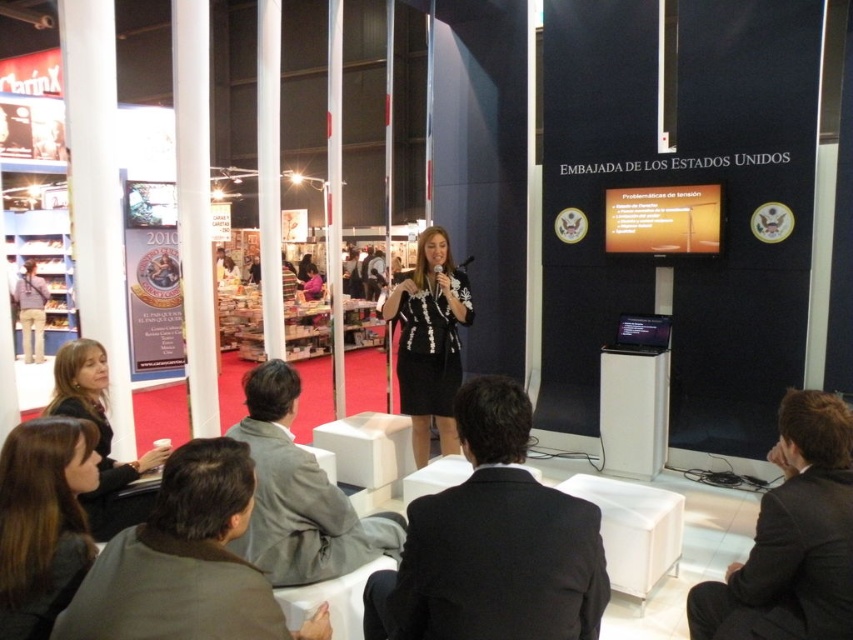
Question: Can you confirm if gray wool suit at lower center is positioned above matte black jacket at lower left?

Choices:
 (A) yes
 (B) no

Answer: (B)

Question: Among these objects, which one is farthest from the camera?

Choices:
 (A) black suit at center
 (B) black suit at lower right
 (C) gray wool suit at lower center

Answer: (C)

Question: Which object is the farthest from the black suit at lower right?

Choices:
 (A) brown fabric suit at lower left
 (B) dark brown hair at lower left
 (C) black suit at center
 (D) khaki cotton pants at lower left

Answer: (D)

Question: Is black suit at lower right wider than gray wool suit at lower center?

Choices:
 (A) no
 (B) yes

Answer: (A)

Question: In this image, where is black suit at center located relative to gray wool suit at lower center?

Choices:
 (A) left
 (B) right

Answer: (B)

Question: Which point is closer to the camera?

Choices:
 (A) dark brown hair at lower left
 (B) khaki cotton pants at lower left

Answer: (A)